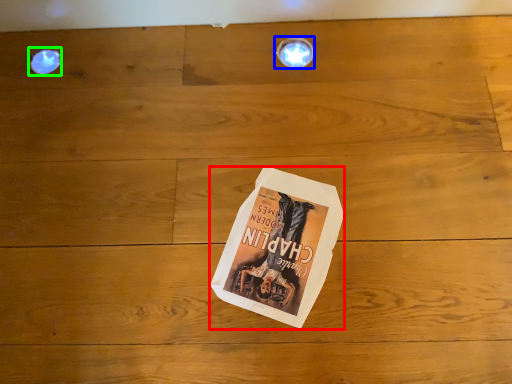
Question: Which object is positioned closest to paperback book (highlighted by a red box)? Select from light fixture (highlighted by a blue box) and droplight (highlighted by a green box).

Choices:
 (A) light fixture
 (B) droplight

Answer: (A)